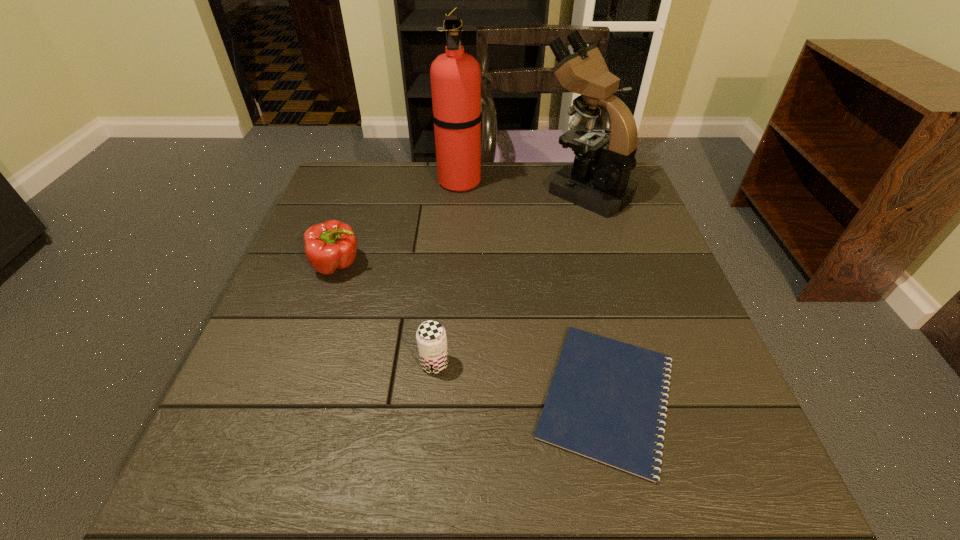
This screenshot has height=540, width=960. In order to click on free space located 0.210m on the left of the shortest object in this screenshot , I will do `click(416, 396)`.

Find the location of a particular element. The width and height of the screenshot is (960, 540). fire extinguisher situated at the far edge is located at coordinates (455, 76).

The width and height of the screenshot is (960, 540). I want to click on microscope at the far edge, so click(598, 180).

The image size is (960, 540). Find the location of `object at the near edge`. object at the near edge is located at coordinates (604, 401).

The width and height of the screenshot is (960, 540). Identify the location of object at the left edge. (329, 246).

At what (x,y) coordinates should I click in order to perform the action: click on microscope at the right edge. Please return your answer as a coordinate pair (x, y). The image size is (960, 540). Looking at the image, I should click on (598, 180).

Find the location of a particular element. notepad positioned at the right edge is located at coordinates (604, 401).

You are a GUI agent. You are given a task and a screenshot of the screen. Output one action in this format:
    pyautogui.click(x=<x>, y=<y>)
    Task: Click on the object present at the far right corner
    This screenshot has height=540, width=960.
    Given the screenshot: What is the action you would take?
    pyautogui.click(x=598, y=180)

This screenshot has height=540, width=960. I want to click on object that is at the near right corner, so click(x=604, y=401).

The height and width of the screenshot is (540, 960). I want to click on free location at the far edge of the desktop, so click(519, 184).